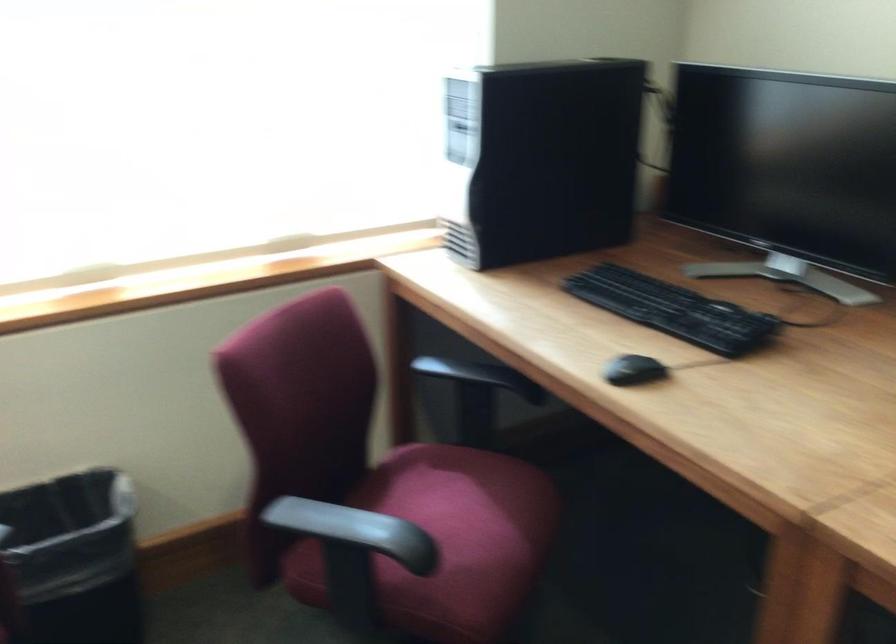
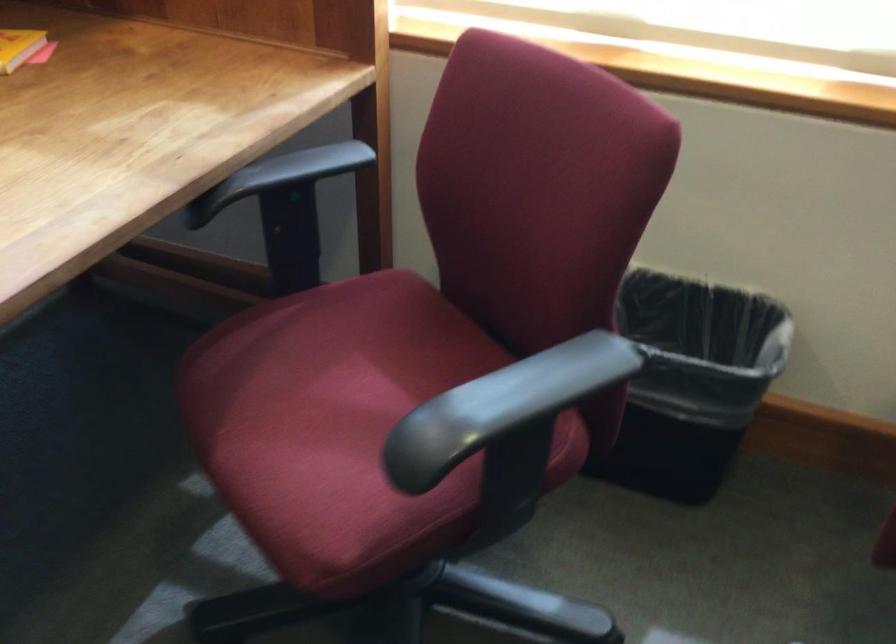
The first image is from the beginning of the video and the second image is from the end. How did the camera likely rotate when shooting the video?

The camera's rotation is toward left-down.